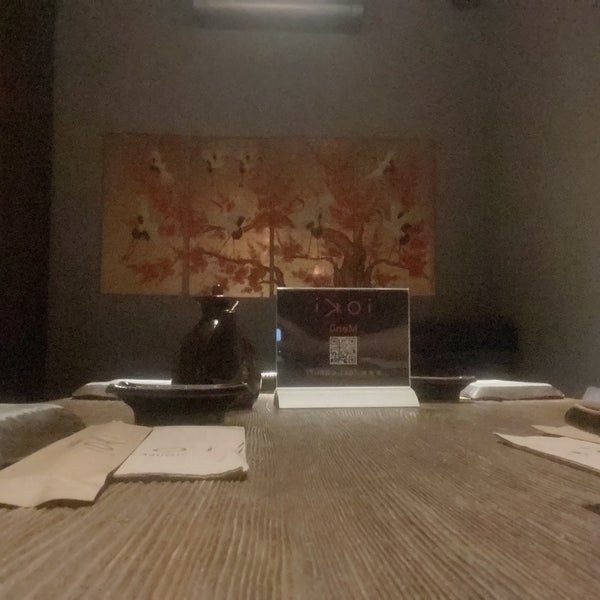
I want to click on empty wall to the left of frame, so click(77, 216).